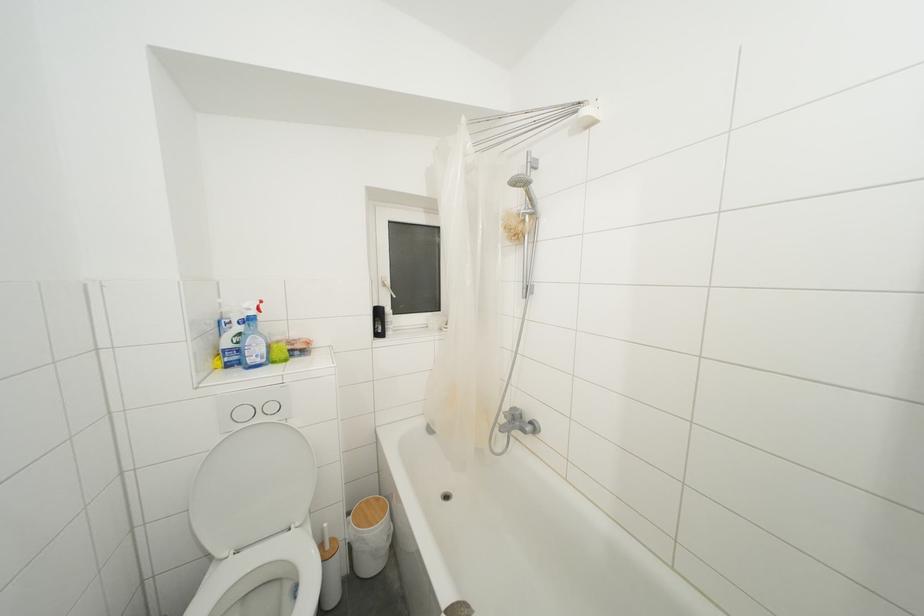
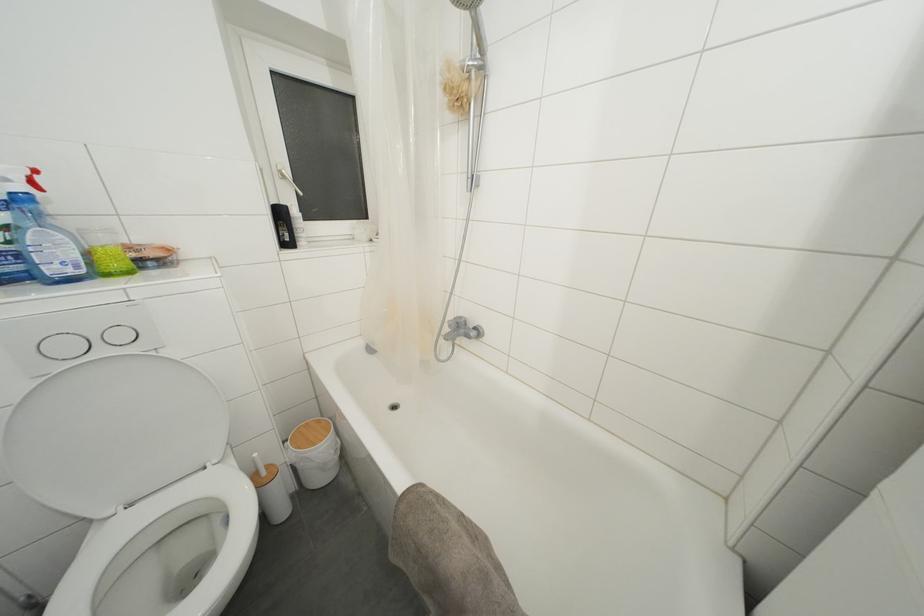
Question: In a continuous first-person perspective shot, in which direction is the camera moving?

Choices:
 (A) Left
 (B) Right
 (C) Forward
 (D) Backward

Answer: (C)